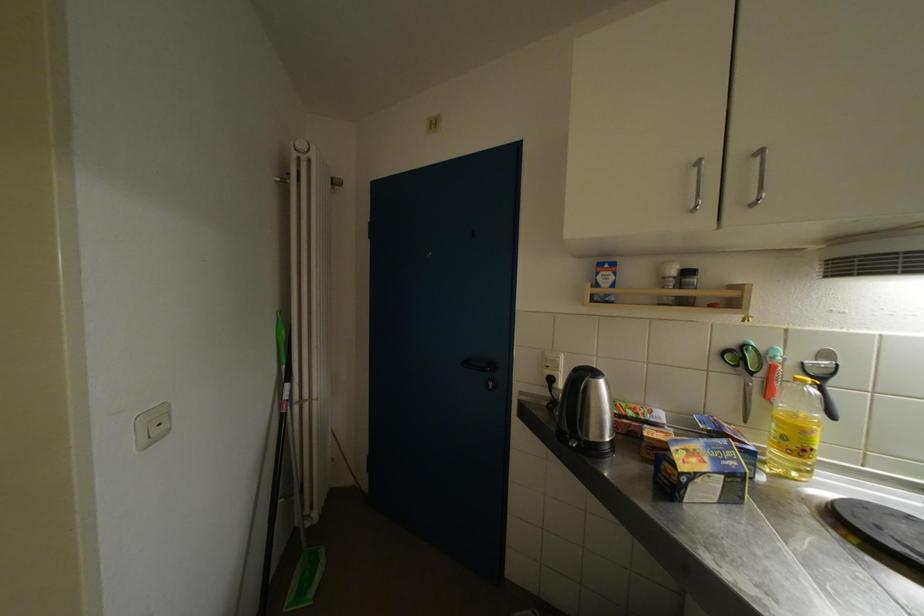
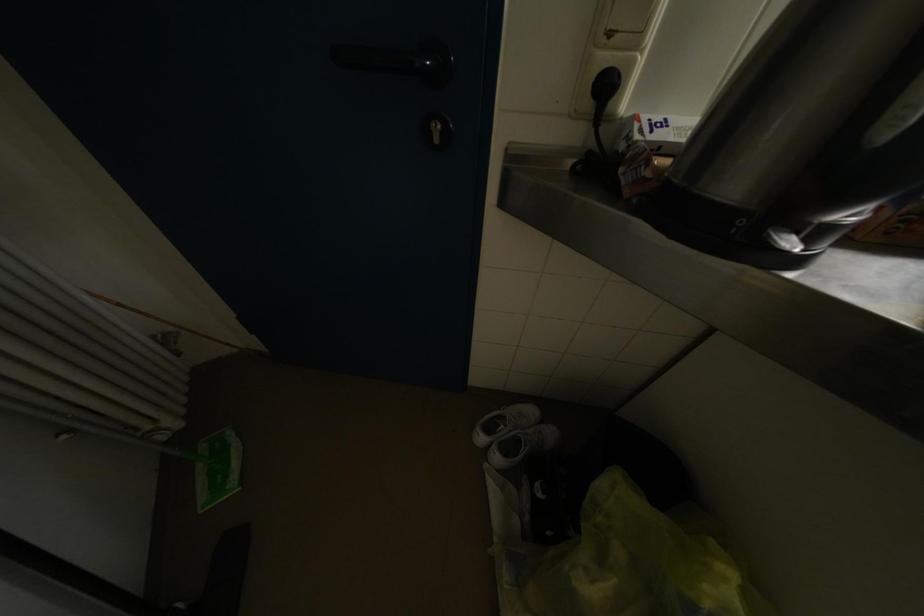
The images are taken continuously from a first-person perspective. In which direction is your viewpoint rotating?

The camera rotated toward right-down.